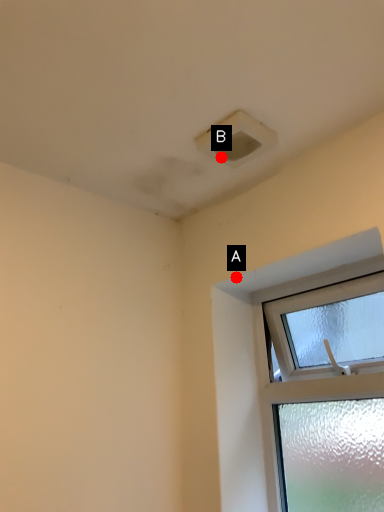
Question: Two points are circled on the image, labeled by A and B beside each circle. Which of the following is the closest to the observer?

Choices:
 (A) A is closer
 (B) B is closer

Answer: (B)